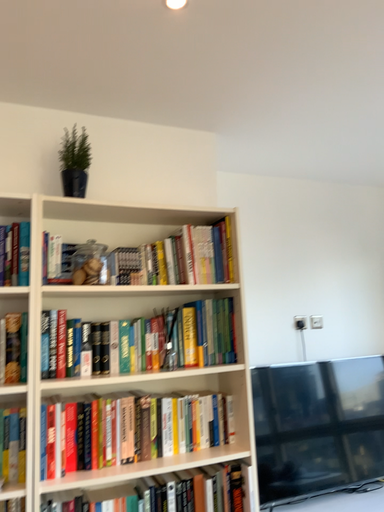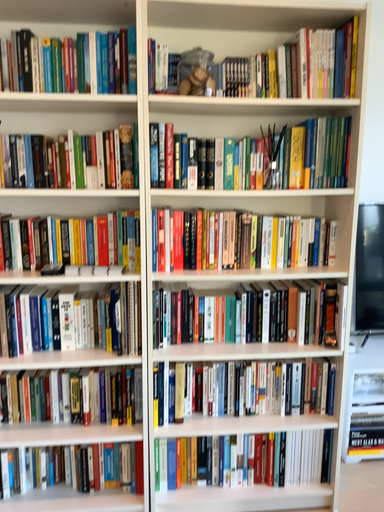
Question: How did the camera likely rotate when shooting the video?

Choices:
 (A) rotated right
 (B) rotated left

Answer: (B)